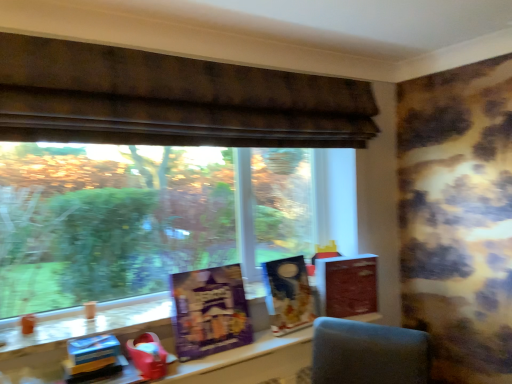
The width and height of the screenshot is (512, 384). I want to click on free region under matte brown book at right, the 1th paperback book from the back (from a real-world perspective), so click(x=358, y=313).